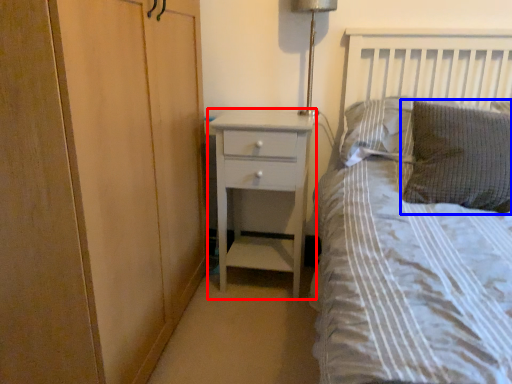
Question: Which object appears closest to the camera in this image, chest of drawers (highlighted by a red box) or pillow (highlighted by a blue box)?

Choices:
 (A) chest of drawers
 (B) pillow

Answer: (B)